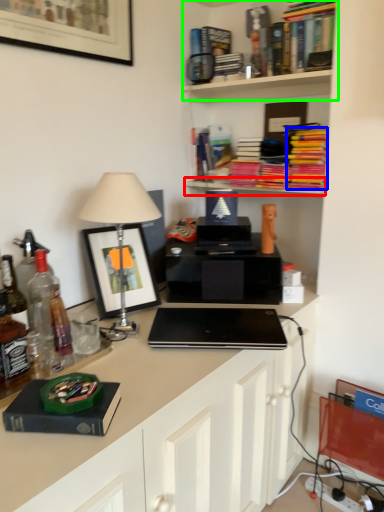
Question: Based on their relative distances, which object is farther from shelf (highlighted by a red box)? Choose from book (highlighted by a blue box) and shelf (highlighted by a green box).

Choices:
 (A) book
 (B) shelf

Answer: (B)